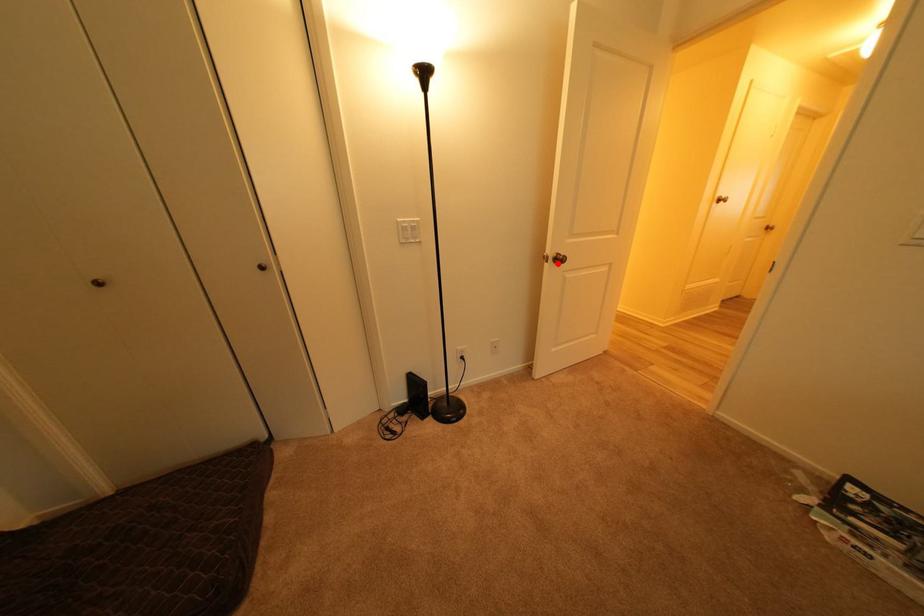
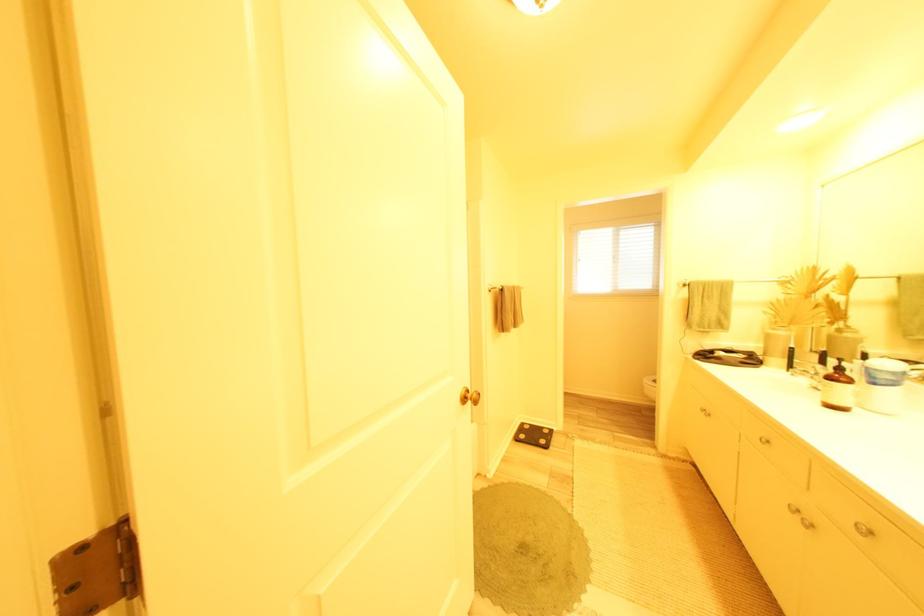
Question: I am providing you with two images of the same scene from different viewpoints. A red point is marked on the first image. At the location where the point appears in image 1, is it still visible in image 2?

Choices:
 (A) Yes
 (B) No

Answer: (B)